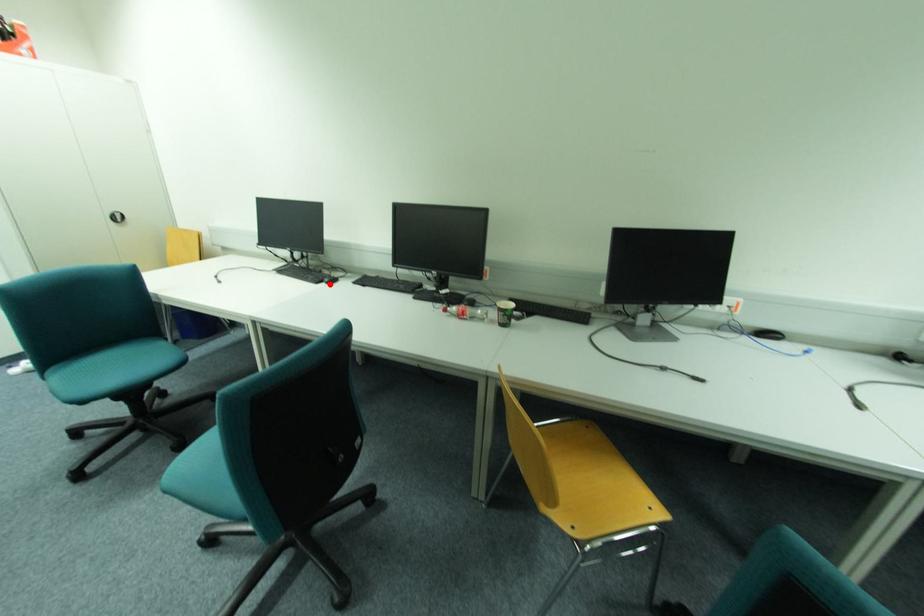
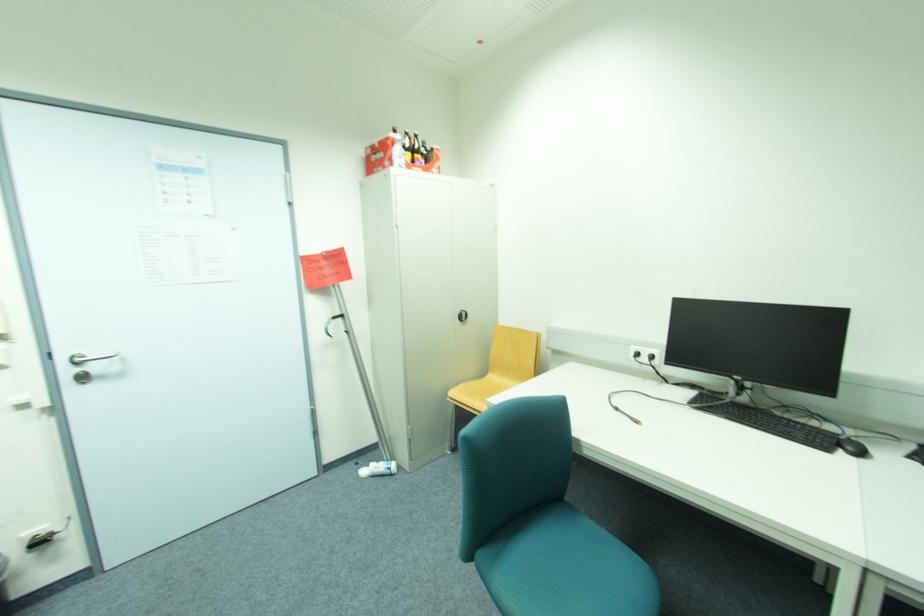
Where in the second image is the point corresponding to the highlighted location from the first image?

(847, 454)